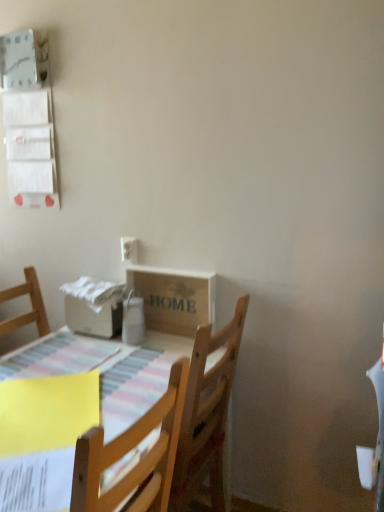
The image size is (384, 512). Find the location of `vacant area on top of wooden table at lower left (from a real-world perspective)`. vacant area on top of wooden table at lower left (from a real-world perspective) is located at coordinates (80, 387).